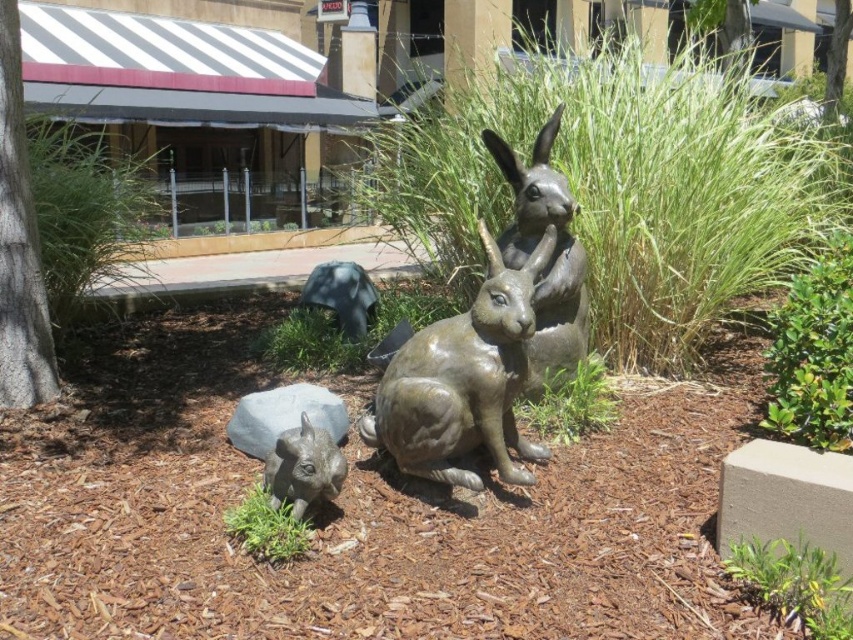
Question: Which point is farther from the camera taking this photo?

Choices:
 (A) (311, 445)
 (B) (567, 308)
 (C) (492, 428)

Answer: (B)

Question: Does bronze rabbit at center have a larger size compared to bronze statue at center?

Choices:
 (A) yes
 (B) no

Answer: (A)

Question: Can you confirm if bronze statue at center is bigger than satin gray rabbit at lower left?

Choices:
 (A) no
 (B) yes

Answer: (B)

Question: Is bronze rabbit at center positioned in front of bronze statue at center?

Choices:
 (A) yes
 (B) no

Answer: (A)

Question: Which point is farther to the camera?

Choices:
 (A) (538, 285)
 (B) (321, 449)

Answer: (A)

Question: Which is farther from the satin gray rabbit at lower left?

Choices:
 (A) bronze statue at center
 (B) bronze rabbit at center

Answer: (A)